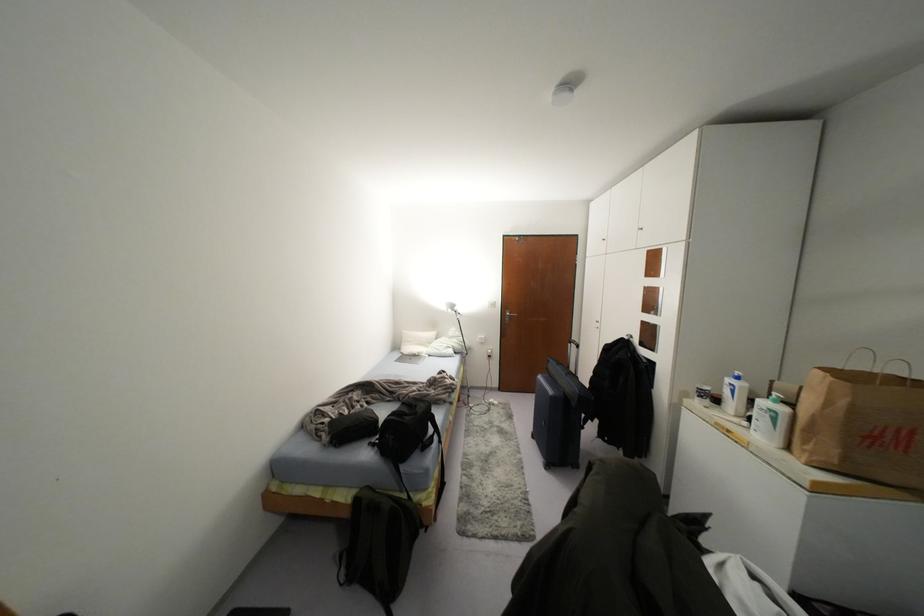
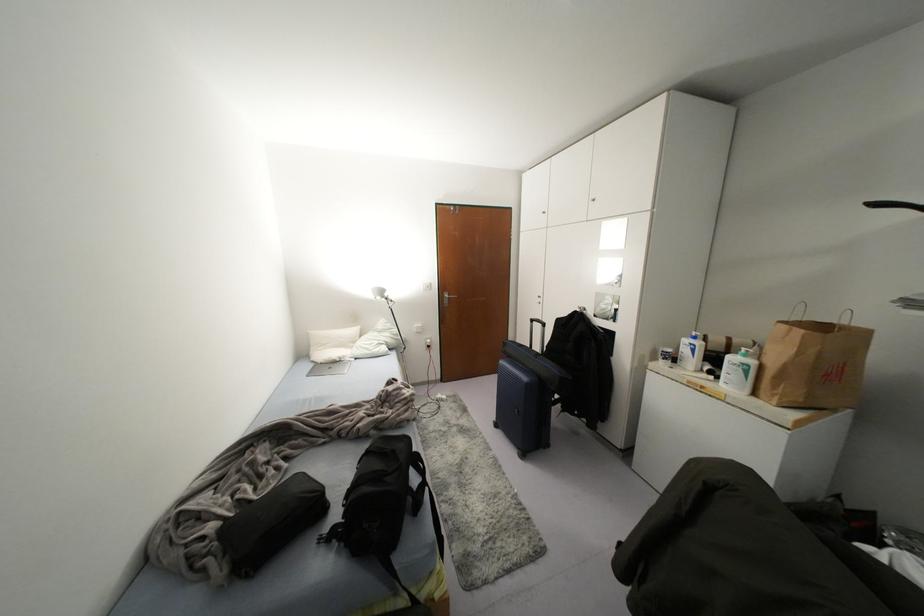
Locate, in the second image, the point that corresponds to point (782, 408) in the first image.

(751, 362)